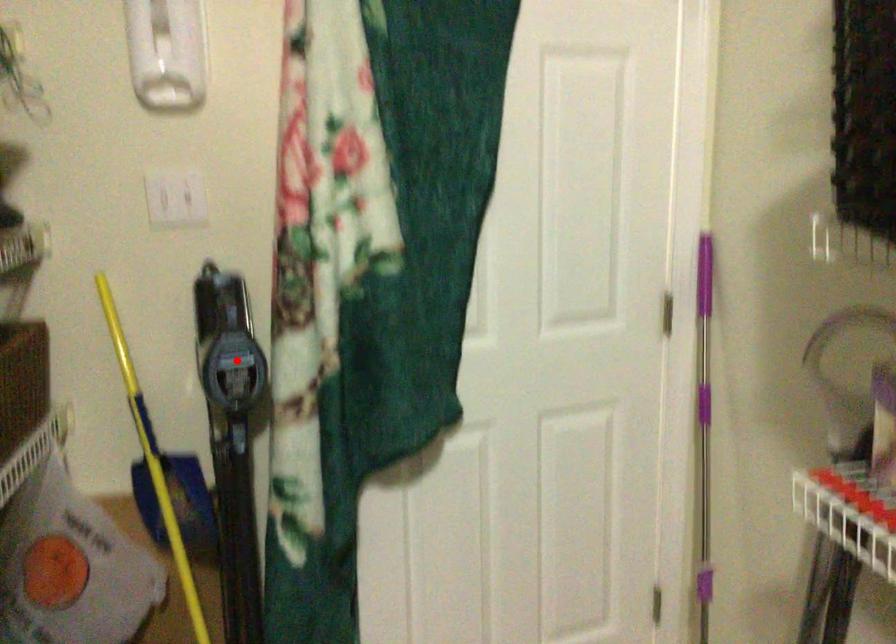
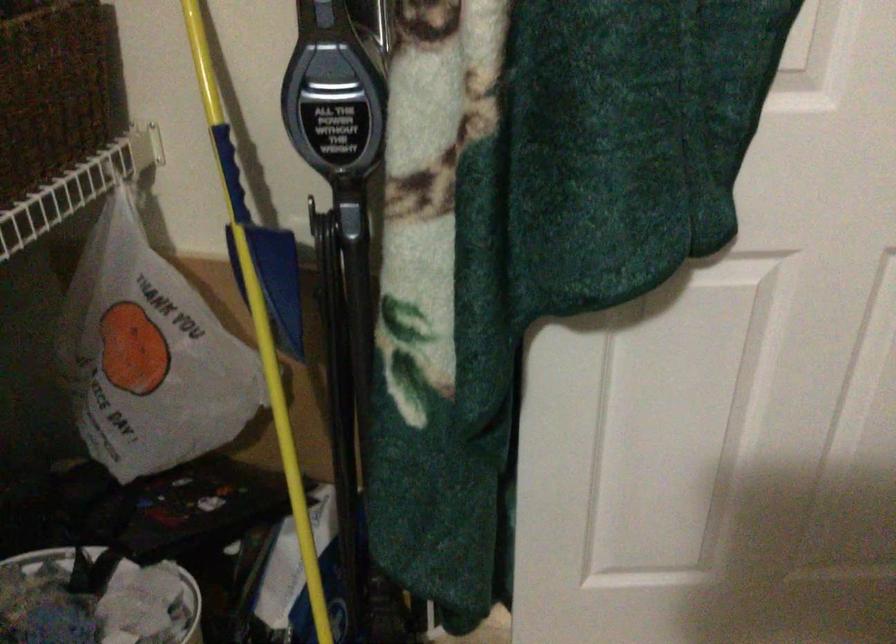
Question: A red point is marked in image1. In image2, is the corresponding 3D point closer to the camera or farther? Reply with the corresponding letter.

Choices:
 (A) The corresponding 3D point is closer.
 (B) The corresponding 3D point is farther.

Answer: (A)